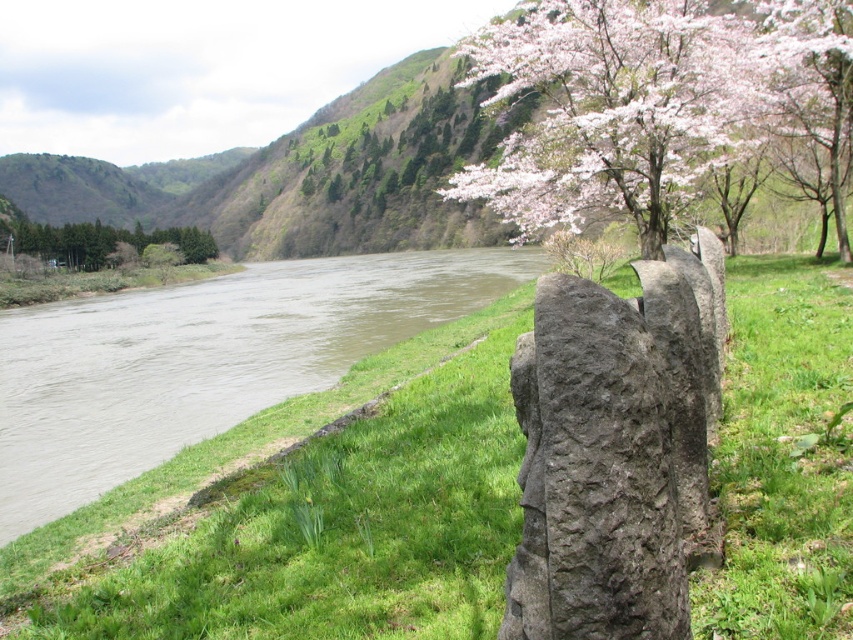
Is pink blossom tree at upper right wider than green textured trees at left?

No.

Which is more to the right, pink blossom tree at upper right or green textured trees at left?

pink blossom tree at upper right

The width and height of the screenshot is (853, 640). Describe the element at coordinates (653, 102) in the screenshot. I see `pink blossom tree at upper right` at that location.

Find the location of a particular element. The image size is (853, 640). pink blossom tree at upper right is located at coordinates (653, 102).

Between brown/muddy water at left and green textured trees at left, which one has less height?

brown/muddy water at left

Between brown/muddy water at left and green textured trees at left, which one is positioned higher?

green textured trees at left

Does point (50, 435) lie behind point (143, 236)?

That is False.

I want to click on brown/muddy water at left, so [206, 358].

Consider the image. Is brown/muddy water at left further to the viewer compared to pink blossom tree at upper right?

No.

Is brown/muddy water at left above pink blossom tree at upper right?

No.

Locate an element on the screen. Image resolution: width=853 pixels, height=640 pixels. brown/muddy water at left is located at coordinates (206, 358).